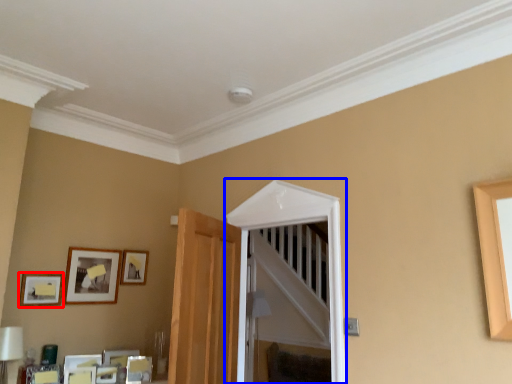
Question: Which object is closer to the camera taking this photo, picture frame (highlighted by a red box) or glass door (highlighted by a blue box)?

Choices:
 (A) picture frame
 (B) glass door

Answer: (B)